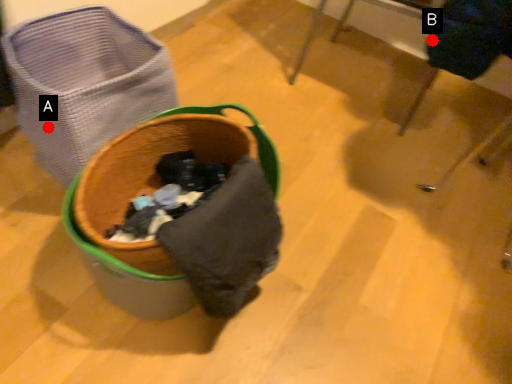
Question: Two points are circled on the image, labeled by A and B beside each circle. Which point appears closest to the camera in this image?

Choices:
 (A) A is closer
 (B) B is closer

Answer: (B)